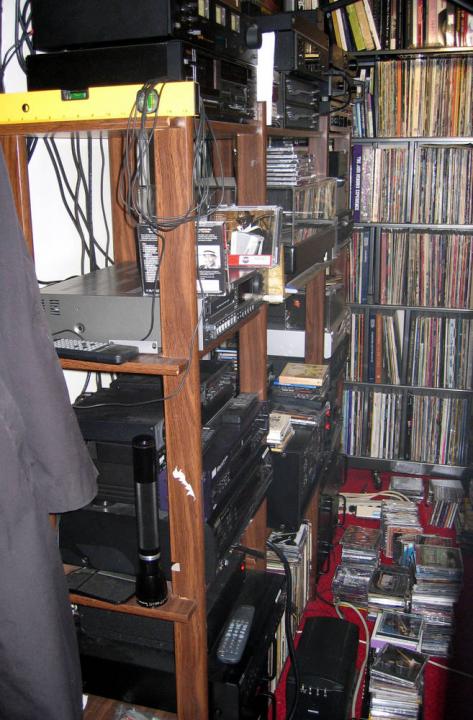
Where is `stacks of cds`? stacks of cds is located at coordinates (406, 680), (409, 628), (397, 592), (434, 569), (348, 559), (404, 518), (447, 497), (410, 489), (436, 481), (276, 155).